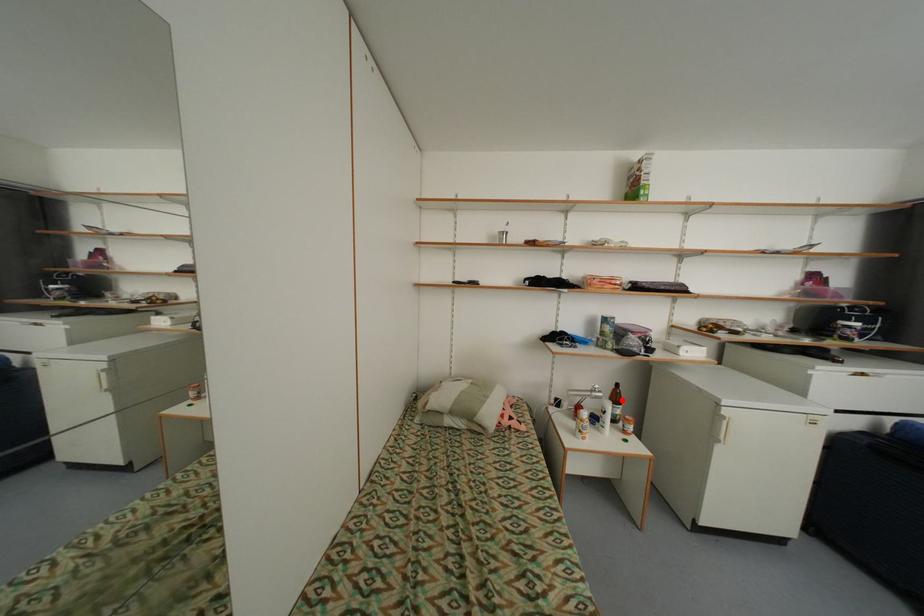
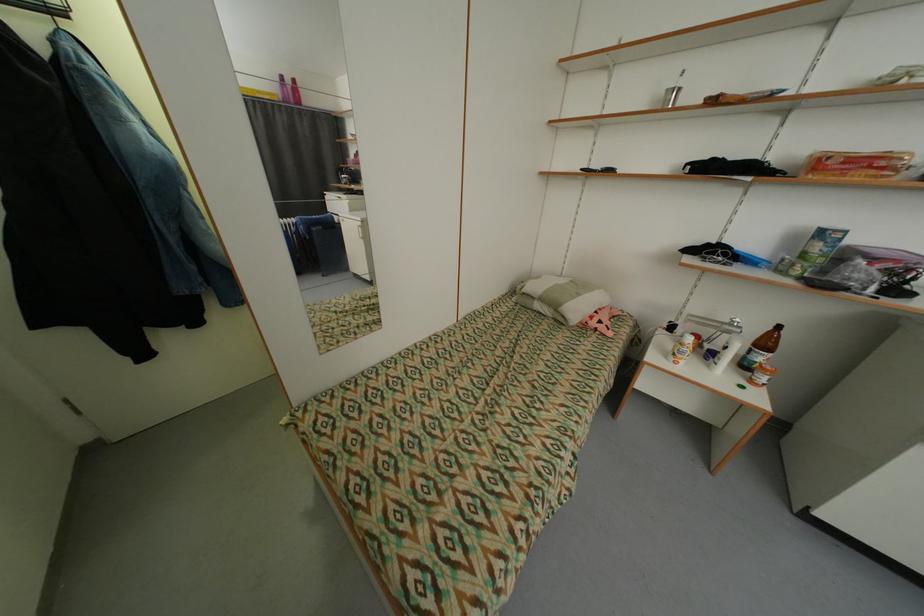
Find the pixel in the second image that matches the highlighted location in the first image.

(772, 345)